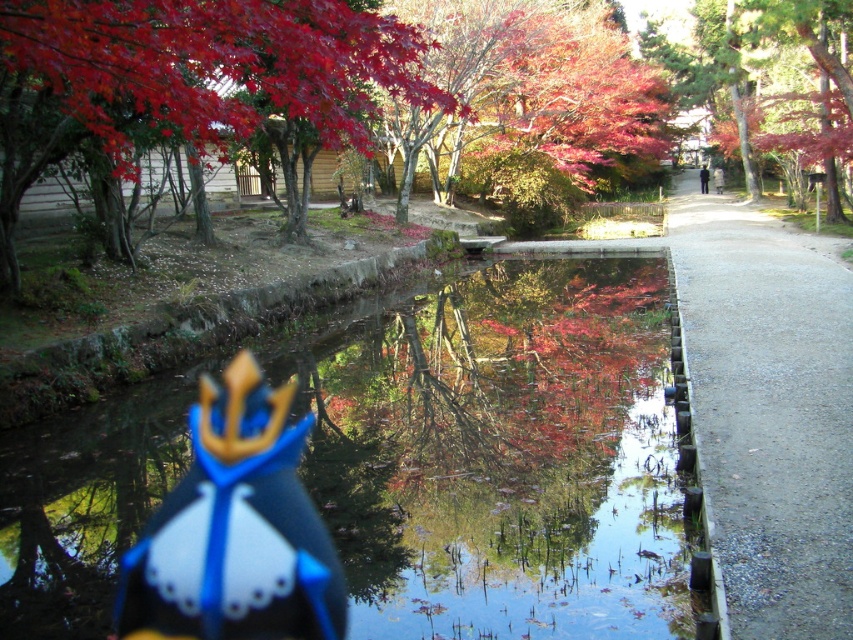
You are a child who wants to play with the blue fabric toy at center. There is a transparent plastic puddle at center in your way. Can you step over the puddle to reach the toy?

The transparent plastic puddle at center is much taller than the blue fabric toy at center, so it might be difficult to step over the puddle because it is taller than the toy.

You are a child playing in the park and you see a transparent plastic puddle at center and a blue fabric toy at center. Which object is wider?

The transparent plastic puddle at center is wider than the blue fabric toy at center.

You are standing at the edge of the pond and want to pick up the blue fabric toy at center. Which direction should you move to first, towards the gravelly gray path at right or away from it?

You should move away from the gravelly gray path at right because the blue fabric toy at center is further away from you than the path, so moving away from the path will bring you closer to the toy.